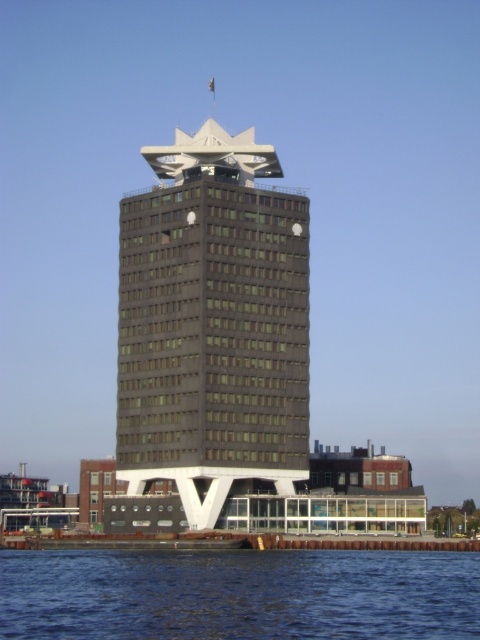
You are standing on the dock and want to reach the blue water at lower left. The dark gray concrete tower at center is in your way. Can you walk around it to get to the water?

The blue water at lower left is behind the dark gray concrete tower at center, so you can walk around the tower to reach the water.

You are standing at the coordinates of the dark gray concrete tower at center. Can you see the water body mentioned in the scene description?

The dark gray concrete tower at center is located at point (213, 324). Since the scene describes the building as situated near a body of water, it is likely that the water is visible from the tower.

Looking at this image, you are standing at the point marked as point (x=213, y=324) in the image. What is the nearest object to you in the scene?

The dark gray concrete tower at center is located at point (x=213, y=324), so you are standing right at its location. Therefore, the nearest object to you is the dark gray concrete tower at center itself.